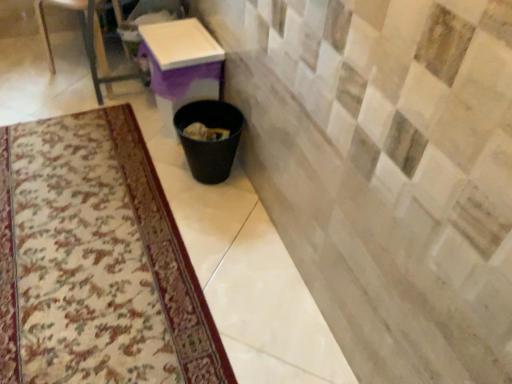
This screenshot has height=384, width=512. Identify the location of vacant position to the left of white glossy table at center. (126, 121).